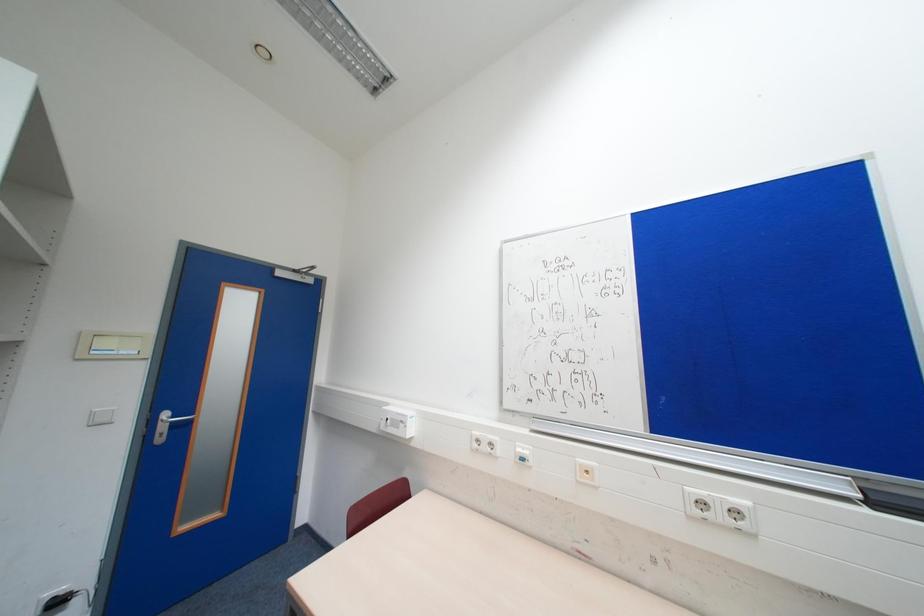
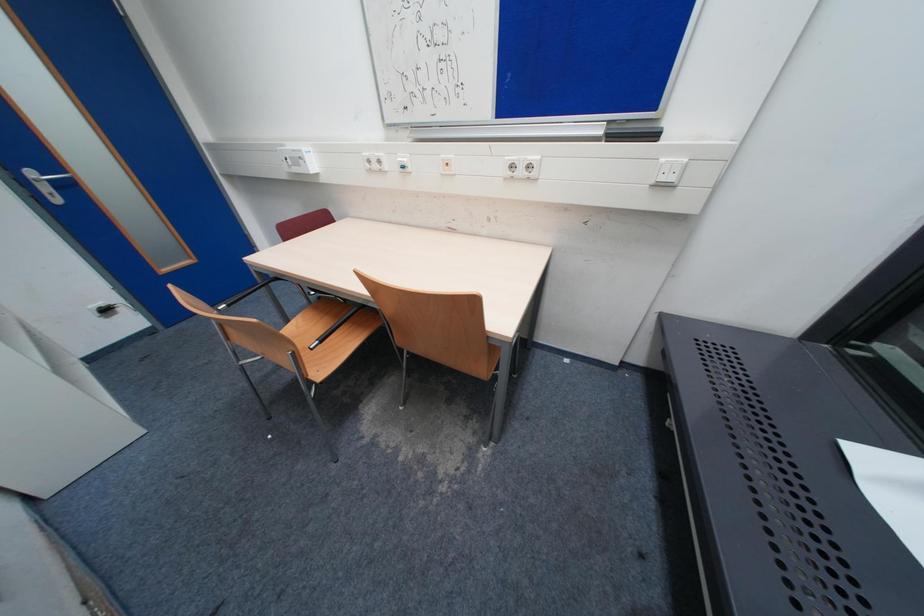
Question: Based on the continuous images, in which direction is the camera rotating? Reply with the corresponding letter.

Choices:
 (A) Left
 (B) Right
 (C) Up
 (D) Down

Answer: (D)